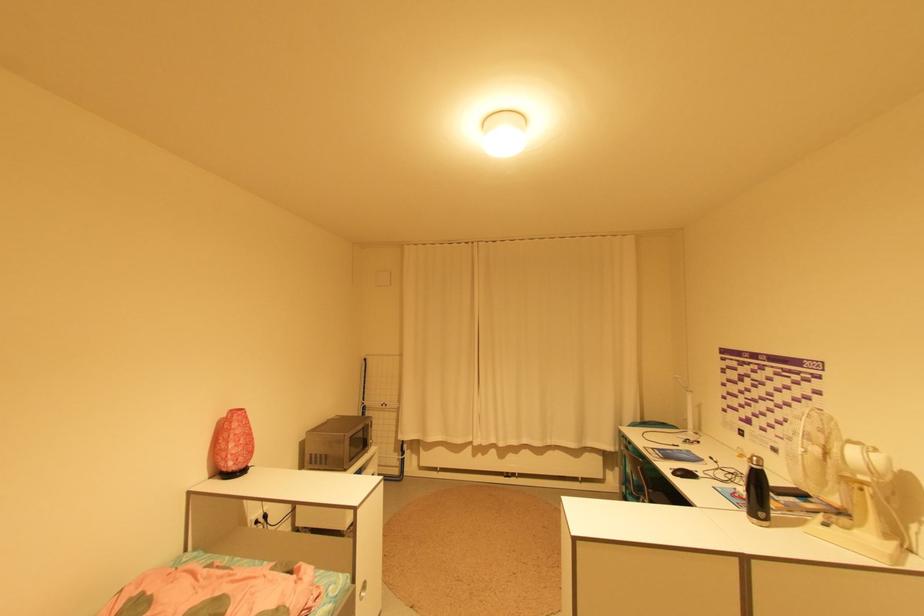
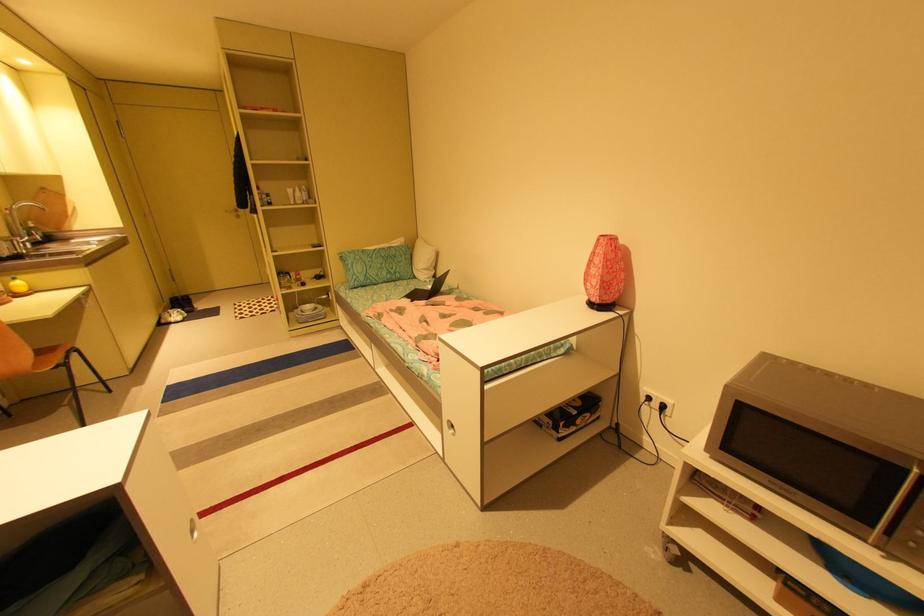
The point at (271, 516) is marked in the first image. Where is the corresponding point in the second image?

(669, 407)